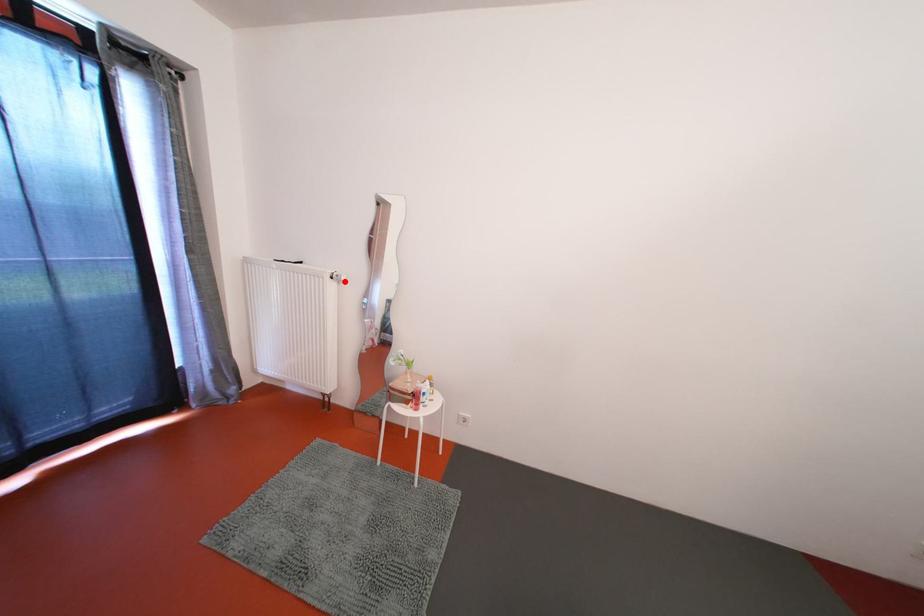
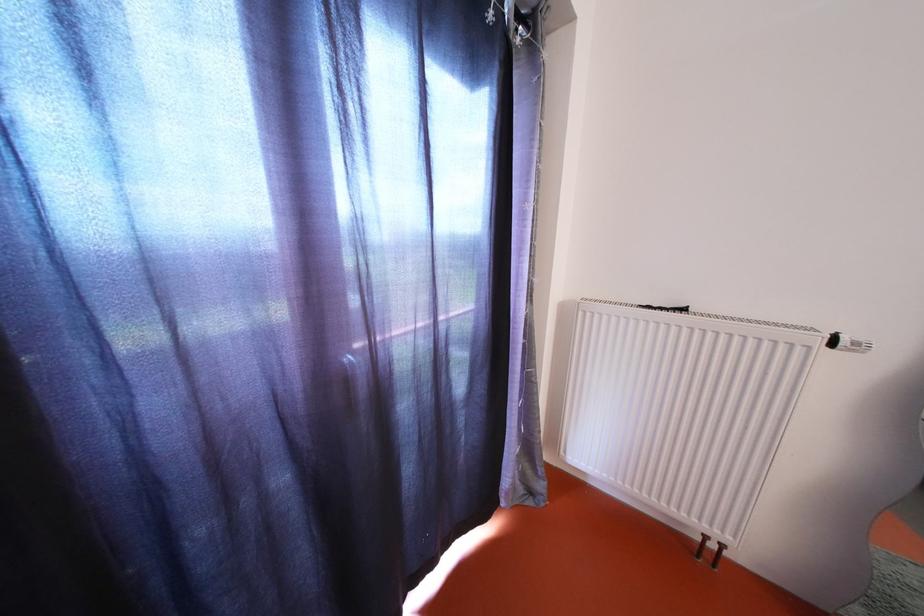
Question: I am providing you with two images of the same scene from different viewpoints. Given a red point in image1, look at the same physical point in image2. Is it:

Choices:
 (A) Closer to the viewpoint
 (B) Farther from the viewpoint

Answer: (A)